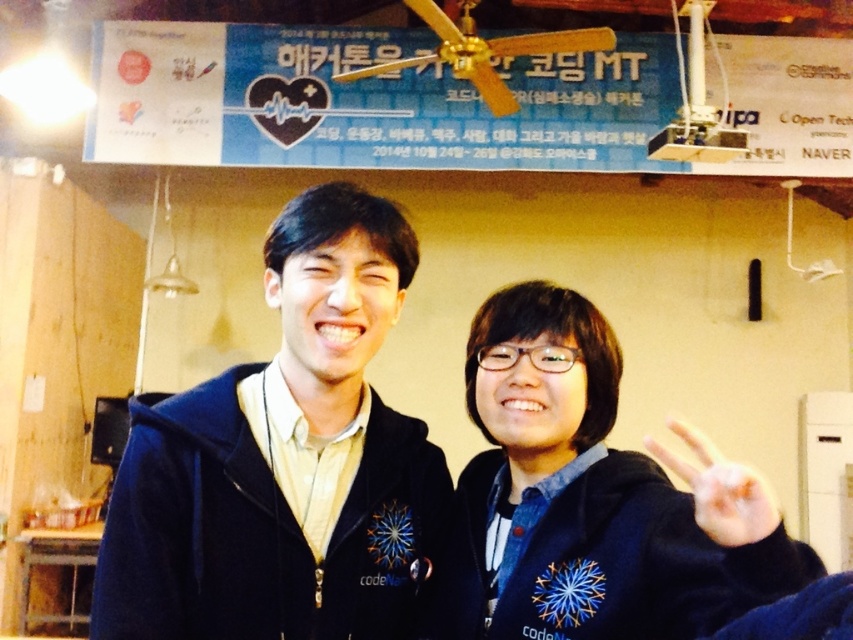
Does matte black hoodie at center appear over white matte hand at center right?

Indeed, matte black hoodie at center is positioned over white matte hand at center right.

Which of these two, matte black hoodie at center or white matte hand at center right, stands taller?

matte black hoodie at center

Is point (392, 604) closer to camera compared to point (672, 454)?

No, it is behind (672, 454).

Where is `matte black hoodie at center`? matte black hoodie at center is located at coordinates (283, 460).

Does navy blue hoodie at center appear over white matte hand at center right?

Indeed, navy blue hoodie at center is positioned over white matte hand at center right.

Which is in front, point (558, 614) or point (722, 508)?

Point (722, 508)

Is point (668, 596) closer to camera compared to point (671, 465)?

That is False.

You are a GUI agent. You are given a task and a screenshot of the screen. Output one action in this format:
    pyautogui.click(x=<x>, y=<y>)
    Task: Click on the navy blue hoodie at center
    
    Given the screenshot: What is the action you would take?
    pyautogui.click(x=294, y=467)

Does navy blue hoodie at center have a smaller size compared to matte black hoodie at center?

Actually, navy blue hoodie at center might be larger than matte black hoodie at center.

Between point (596, 444) and point (302, 561), which one is positioned behind?

Point (596, 444)

This screenshot has width=853, height=640. What do you see at coordinates (294, 467) in the screenshot? I see `navy blue hoodie at center` at bounding box center [294, 467].

The height and width of the screenshot is (640, 853). Identify the location of navy blue hoodie at center. (294, 467).